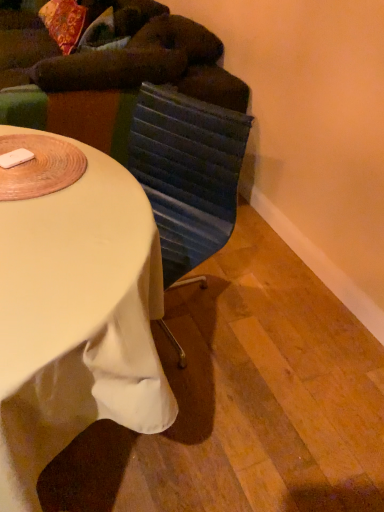
Image resolution: width=384 pixels, height=512 pixels. I want to click on vacant area situated below textured blue swivel chair at center (from a real-world perspective), so click(x=183, y=300).